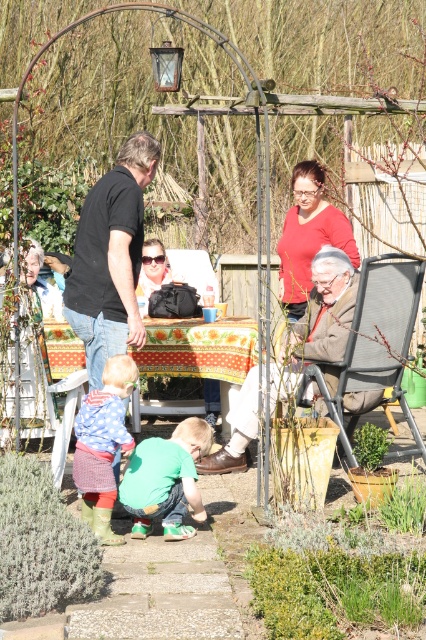
Question: Is the position of floral tablecloth at center more distant than that of brown leather jacket at center?

Choices:
 (A) yes
 (B) no

Answer: (A)

Question: Estimate the real-world distances between objects in this image. Which object is farther from the matte red shirt at upper center?

Choices:
 (A) brown leather jacket at center
 (B) black matte shirt at left
 (C) green leafy plant at lower center

Answer: (C)

Question: Which point is farther to the camera?

Choices:
 (A) (365, 378)
 (B) (23, 611)

Answer: (A)

Question: Among these points, which one is farthest from the camera?

Choices:
 (A) (115, 403)
 (B) (104, 310)

Answer: (B)

Question: Is green matte shirt at lower center behind brown leather jacket at center?

Choices:
 (A) no
 (B) yes

Answer: (A)

Question: Does green leafy plant at lower center appear over green matte shirt at lower center?

Choices:
 (A) no
 (B) yes

Answer: (A)